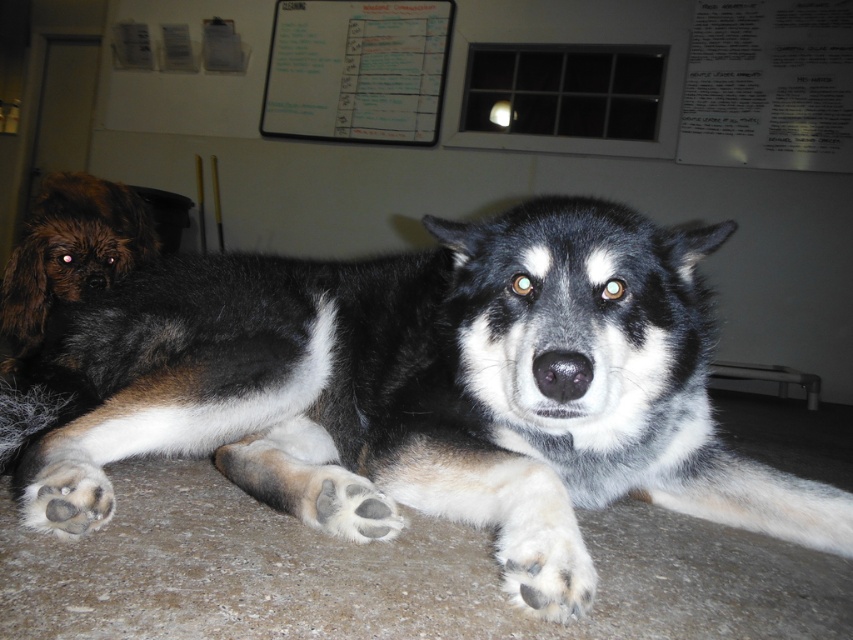
Does black and white fur dog at center come behind white fur at lower center?

Yes, it is.

Does point (579, 435) lie behind point (515, 547)?

Yes, point (579, 435) is behind point (515, 547).

Is point (299, 400) positioned after point (514, 561)?

Yes, point (299, 400) is farther from viewer.

Where is `black and white fur dog at center`? This screenshot has height=640, width=853. black and white fur dog at center is located at coordinates (424, 376).

Looking at this image, does brown fuzzy dog at left appear on the right side of fuzzy fur paw at lower center?

Incorrect, brown fuzzy dog at left is not on the right side of fuzzy fur paw at lower center.

Who is positioned more to the right, brown fuzzy dog at left or fuzzy fur paw at lower center?

fuzzy fur paw at lower center is more to the right.

Does point (28, 316) come farther from viewer compared to point (350, 493)?

Yes, it is behind point (350, 493).

Where is `brown fuzzy dog at left`? Image resolution: width=853 pixels, height=640 pixels. brown fuzzy dog at left is located at coordinates (70, 250).

Between brown fuzzy dog at left and fuzzy fur paw at lower left, which one is positioned higher?

brown fuzzy dog at left is higher up.

Locate an element on the screen. brown fuzzy dog at left is located at coordinates (70, 250).